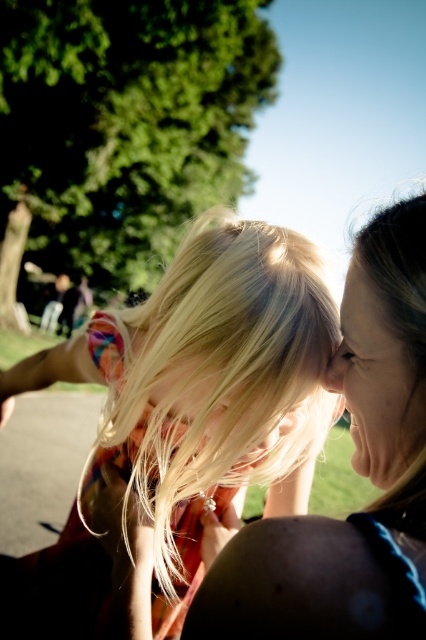
You are a photographer capturing this scene. You want to ensure that both the blonde hair at center and the matte black hair at center are clearly visible in the final photo. Based on their positions, which hair might be more challenging to capture clearly due to overlapping?

The blonde hair at center is positioned over matte black hair at center, so the matte black hair at center might be more challenging to capture clearly because it is partially obscured by the blonde hair.